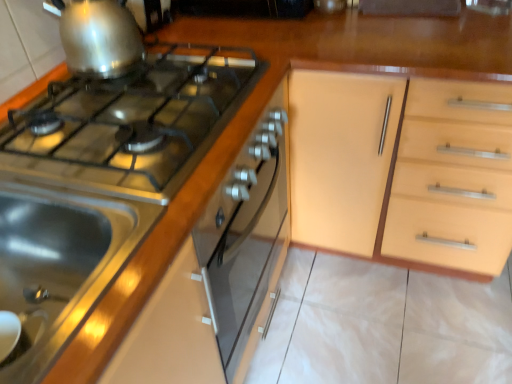
Describe the element at coordinates (99, 37) in the screenshot. This screenshot has width=512, height=384. I see `shiny metallic kettle at upper left, arranged as the first kitchen appliance when viewed from the top` at that location.

What do you see at coordinates (101, 183) in the screenshot?
I see `stainless steel stove at upper left, which is counted as the 1th kitchen appliance, starting from the bottom` at bounding box center [101, 183].

Where is `stainless steel stove at upper left, the second kitchen appliance when ordered from top to bottom`? Image resolution: width=512 pixels, height=384 pixels. stainless steel stove at upper left, the second kitchen appliance when ordered from top to bottom is located at coordinates (101, 183).

Describe the element at coordinates (59, 264) in the screenshot. I see `stainless steel sink at lower left` at that location.

Locate an element on the screen. The image size is (512, 384). shiny metallic kettle at upper left, arranged as the first kitchen appliance when viewed from the top is located at coordinates (99, 37).

Is stainless steel sink at lower left oriented away from satin silver gas stove at left?

stainless steel sink at lower left is not turned away from satin silver gas stove at left.

Is stainless steel sink at lower left surrounding satin silver gas stove at left?

No, satin silver gas stove at left is located outside of stainless steel sink at lower left.

Where is `gas stove behind the stainless steel sink at lower left`? The image size is (512, 384). gas stove behind the stainless steel sink at lower left is located at coordinates (132, 123).

From a real-world perspective, is stainless steel sink at lower left physically above satin silver gas stove at left?

No, from a real-world perspective, stainless steel sink at lower left is not over satin silver gas stove at left

Would you say shiny metallic kettle at upper left, which is counted as the 2th kitchen appliance, starting from the bottom, is to the left or to the right of stainless steel sink at lower left in the picture?

shiny metallic kettle at upper left, which is counted as the 2th kitchen appliance, starting from the bottom, is to the right of stainless steel sink at lower left.

Is shiny metallic kettle at upper left, arranged as the first kitchen appliance when viewed from the top, behind stainless steel sink at lower left?

Yes, it is.

From a real-world perspective, is shiny metallic kettle at upper left, arranged as the first kitchen appliance when viewed from the top, above or below stainless steel sink at lower left?

shiny metallic kettle at upper left, arranged as the first kitchen appliance when viewed from the top, is situated higher than stainless steel sink at lower left in the real world.

Can you confirm if shiny metallic kettle at upper left, which is counted as the 2th kitchen appliance, starting from the bottom, is thinner than stainless steel sink at lower left?

Indeed, shiny metallic kettle at upper left, which is counted as the 2th kitchen appliance, starting from the bottom, has a lesser width compared to stainless steel sink at lower left.

Does shiny metallic kettle at upper left, which is counted as the 2th kitchen appliance, starting from the bottom, have a lesser width compared to stainless steel stove at upper left, the second kitchen appliance when ordered from top to bottom?

Yes, shiny metallic kettle at upper left, which is counted as the 2th kitchen appliance, starting from the bottom, is thinner than stainless steel stove at upper left, the second kitchen appliance when ordered from top to bottom.

Is shiny metallic kettle at upper left, arranged as the first kitchen appliance when viewed from the top, not close to stainless steel stove at upper left, which is counted as the 1th kitchen appliance, starting from the bottom?

They are positioned close to each other.

Would you say shiny metallic kettle at upper left, arranged as the first kitchen appliance when viewed from the top, is outside stainless steel stove at upper left, the second kitchen appliance when ordered from top to bottom?

Indeed, shiny metallic kettle at upper left, arranged as the first kitchen appliance when viewed from the top, is completely outside stainless steel stove at upper left, the second kitchen appliance when ordered from top to bottom.

Is point (95, 73) closer to camera compared to point (59, 326)?

No, it is behind (59, 326).

Where is `kitchen appliance above the satin silver gas stove at left (from a real-world perspective)`? Image resolution: width=512 pixels, height=384 pixels. kitchen appliance above the satin silver gas stove at left (from a real-world perspective) is located at coordinates (99, 37).

Which object is further away from the camera, satin silver gas stove at left or shiny metallic kettle at upper left, which is counted as the 2th kitchen appliance, starting from the bottom?

shiny metallic kettle at upper left, which is counted as the 2th kitchen appliance, starting from the bottom.

Between satin silver gas stove at left and shiny metallic kettle at upper left, arranged as the first kitchen appliance when viewed from the top, which one has less height?

Standing shorter between the two is satin silver gas stove at left.

In terms of size, does satin silver gas stove at left appear bigger or smaller than stainless steel stove at upper left, the second kitchen appliance when ordered from top to bottom?

In the image, satin silver gas stove at left appears to be smaller than stainless steel stove at upper left, the second kitchen appliance when ordered from top to bottom.

From a real-world perspective, between satin silver gas stove at left and stainless steel stove at upper left, the second kitchen appliance when ordered from top to bottom, who is vertically higher?

satin silver gas stove at left is physically above.

Is satin silver gas stove at left not within stainless steel stove at upper left, which is counted as the 1th kitchen appliance, starting from the bottom?

No.

Based on their positions, is satin silver gas stove at left located to the left or right of stainless steel stove at upper left, which is counted as the 1th kitchen appliance, starting from the bottom?

In the image, satin silver gas stove at left appears on the left side of stainless steel stove at upper left, which is counted as the 1th kitchen appliance, starting from the bottom.

Between stainless steel sink at lower left and stainless steel stove at upper left, which is counted as the 1th kitchen appliance, starting from the bottom, which one has larger width?

With larger width is stainless steel stove at upper left, which is counted as the 1th kitchen appliance, starting from the bottom.

In terms of size, does stainless steel sink at lower left appear bigger or smaller than stainless steel stove at upper left, which is counted as the 1th kitchen appliance, starting from the bottom?

Considering their sizes, stainless steel sink at lower left takes up less space than stainless steel stove at upper left, which is counted as the 1th kitchen appliance, starting from the bottom.

Based on the photo, could you measure the distance between stainless steel sink at lower left and stainless steel stove at upper left, the second kitchen appliance when ordered from top to bottom?

stainless steel sink at lower left and stainless steel stove at upper left, the second kitchen appliance when ordered from top to bottom, are 3.51 inches apart from each other.

Considering the positions of points (90, 200) and (121, 144), is point (90, 200) farther from camera compared to point (121, 144)?

No, it is not.

Is stainless steel stove at upper left, the second kitchen appliance when ordered from top to bottom, oriented towards stainless steel sink at lower left?

No, stainless steel stove at upper left, the second kitchen appliance when ordered from top to bottom, is not turned towards stainless steel sink at lower left.

How many degrees apart are the facing directions of stainless steel stove at upper left, the second kitchen appliance when ordered from top to bottom, and stainless steel sink at lower left?

The angular difference between stainless steel stove at upper left, the second kitchen appliance when ordered from top to bottom, and stainless steel sink at lower left is 0.942 degrees.

Is stainless steel stove at upper left, the second kitchen appliance when ordered from top to bottom, not close to stainless steel sink at lower left?

No.

Between stainless steel stove at upper left, which is counted as the 1th kitchen appliance, starting from the bottom, and stainless steel sink at lower left, which one appears on the right side from the viewer's perspective?

Positioned to the right is stainless steel stove at upper left, which is counted as the 1th kitchen appliance, starting from the bottom.

Find the location of a particular element. sink on the left of satin silver gas stove at left is located at coordinates (59, 264).

What are the coordinates of `kitchen appliance lying above the stainless steel sink at lower left (from the image's perspective)` in the screenshot? It's located at (99, 37).

Which object lies further to the anchor point stainless steel stove at upper left, the second kitchen appliance when ordered from top to bottom, shiny metallic kettle at upper left, which is counted as the 2th kitchen appliance, starting from the bottom, or satin silver gas stove at left?

shiny metallic kettle at upper left, which is counted as the 2th kitchen appliance, starting from the bottom.

Looking at the image, which one is located closer to satin silver gas stove at left, shiny metallic kettle at upper left, arranged as the first kitchen appliance when viewed from the top, or stainless steel sink at lower left?

shiny metallic kettle at upper left, arranged as the first kitchen appliance when viewed from the top, is closer to satin silver gas stove at left.

Based on their spatial positions, is stainless steel stove at upper left, which is counted as the 1th kitchen appliance, starting from the bottom, or satin silver gas stove at left further from stainless steel sink at lower left?

satin silver gas stove at left is further to stainless steel sink at lower left.

Based on their spatial positions, is shiny metallic kettle at upper left, which is counted as the 2th kitchen appliance, starting from the bottom, or stainless steel stove at upper left, which is counted as the 1th kitchen appliance, starting from the bottom, further from stainless steel sink at lower left?

Among the two, shiny metallic kettle at upper left, which is counted as the 2th kitchen appliance, starting from the bottom, is located further to stainless steel sink at lower left.

From the image, which object appears to be nearer to stainless steel stove at upper left, the second kitchen appliance when ordered from top to bottom, stainless steel sink at lower left or satin silver gas stove at left?

Based on the image, satin silver gas stove at left appears to be nearer to stainless steel stove at upper left, the second kitchen appliance when ordered from top to bottom.

Which object lies nearer to the anchor point stainless steel sink at lower left, satin silver gas stove at left or stainless steel stove at upper left, which is counted as the 1th kitchen appliance, starting from the bottom?

stainless steel stove at upper left, which is counted as the 1th kitchen appliance, starting from the bottom, is closer to stainless steel sink at lower left.

Considering their positions, is stainless steel stove at upper left, which is counted as the 1th kitchen appliance, starting from the bottom, positioned closer to satin silver gas stove at left than stainless steel sink at lower left?

Based on the image, stainless steel stove at upper left, which is counted as the 1th kitchen appliance, starting from the bottom, appears to be nearer to satin silver gas stove at left.

When comparing their distances from satin silver gas stove at left, does shiny metallic kettle at upper left, which is counted as the 2th kitchen appliance, starting from the bottom, or stainless steel stove at upper left, the second kitchen appliance when ordered from top to bottom, seem further?

Among the two, shiny metallic kettle at upper left, which is counted as the 2th kitchen appliance, starting from the bottom, is located further to satin silver gas stove at left.

What are the coordinates of `gas stove that lies between shiny metallic kettle at upper left, arranged as the first kitchen appliance when viewed from the top, and stainless steel sink at lower left from top to bottom` in the screenshot? It's located at (132, 123).

What are the coordinates of `gas stove that lies between shiny metallic kettle at upper left, which is counted as the 2th kitchen appliance, starting from the bottom, and stainless steel stove at upper left, which is counted as the 1th kitchen appliance, starting from the bottom, from top to bottom` in the screenshot? It's located at (132, 123).

Identify the location of sink that lies between satin silver gas stove at left and stainless steel stove at upper left, which is counted as the 1th kitchen appliance, starting from the bottom, from top to bottom. The height and width of the screenshot is (384, 512). (59, 264).

The width and height of the screenshot is (512, 384). Find the location of `sink that lies between shiny metallic kettle at upper left, which is counted as the 2th kitchen appliance, starting from the bottom, and stainless steel stove at upper left, which is counted as the 1th kitchen appliance, starting from the bottom, from top to bottom`. sink that lies between shiny metallic kettle at upper left, which is counted as the 2th kitchen appliance, starting from the bottom, and stainless steel stove at upper left, which is counted as the 1th kitchen appliance, starting from the bottom, from top to bottom is located at coordinates (59, 264).